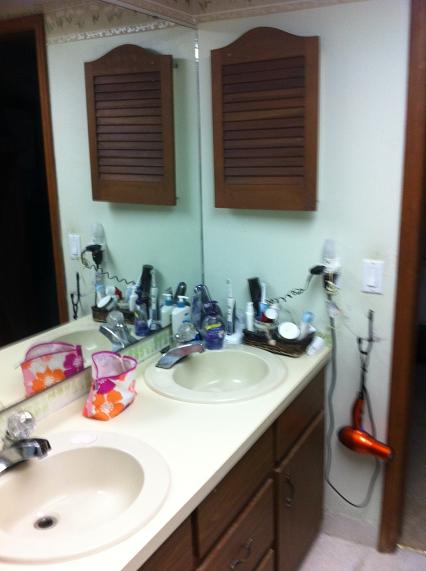
At what (x,y) coordinates should I click in order to perform the action: click on the left sink faucet. Please return your answer as a coordinate pair (x, y). This screenshot has height=571, width=426. Looking at the image, I should click on (21, 446).